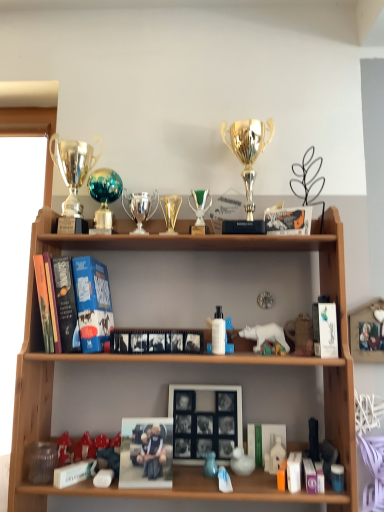
Question: Considering their positions, is transparent plastic jar at lower left, which is the 9th toy from right to left, located in front of or behind wooden shelf at center?

Choices:
 (A) behind
 (B) front

Answer: (A)

Question: Does point (41, 467) appear closer or farther from the camera than point (41, 348)?

Choices:
 (A) closer
 (B) farther

Answer: (A)

Question: Which of these objects is positioned closest to the teal glass trophy at upper center, positioned as the second trophy in right-to-left order?

Choices:
 (A) gold shiny trophy at upper center, which is the 1th trophy from right to left
 (B) matte blue vase at lower center, the 7th toy from the right
 (C) hardcover books at left, the first book from the left
 (D) white matte book at lower right, arranged as the fourth book when viewed from the left
 (E) orange matte toy at lower center, positioned as the 3th toy in right-to-left order

Answer: (C)

Question: Which object is the farthest from the hardcover books at left, the first book from the top?

Choices:
 (A) white plastic bear at center, which ranks as the 4th toy in right-to-left order
 (B) green glass trophy at center, placed as the first candle holder when sorted from right to left
 (C) black matte picture frame at center
 (D) black matte photo frame at center, positioned as the 3th book in top-to-bottom order
 (E) shiny silver trophy at upper left, the 3th trophy viewed from the right

Answer: (A)